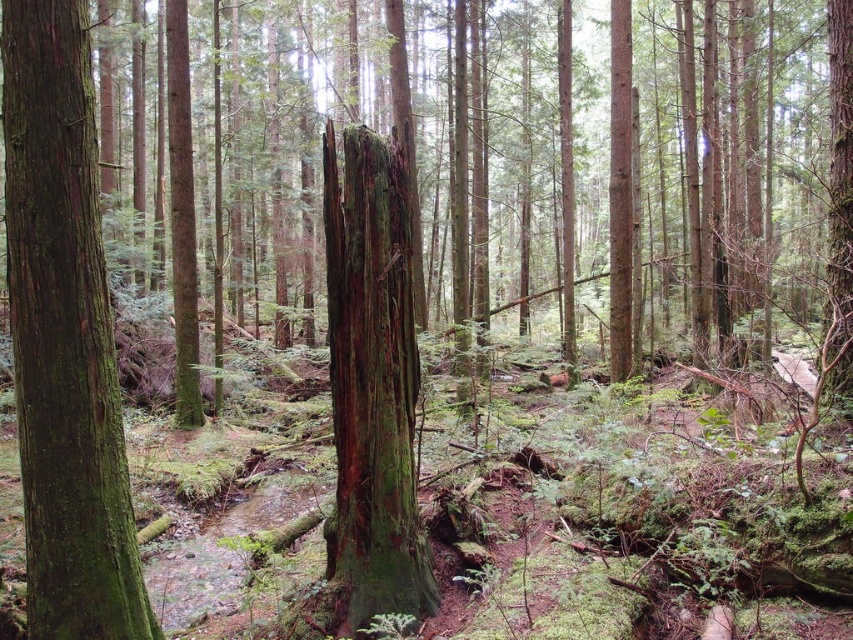
In the forest scene, there are two tree trunks visible. The first is the green rough bark tree trunk at left, and the second is the green mossy tree trunk at center. From the perspective of an observer looking at the image, which of these two tree trunks is positioned more to the left?

The green rough bark tree trunk at left is positioned more to the left compared to the green mossy tree trunk at center.

In the scene shown: You are standing in the forest scene and want to place a small flag at each of the two points labeled point (57, 316) and point (363, 349). Which point will require you to walk further into the forest to reach?

Point (363, 349) will require walking further into the forest because it is farther from the viewer compared to point (57, 316), which is closer.